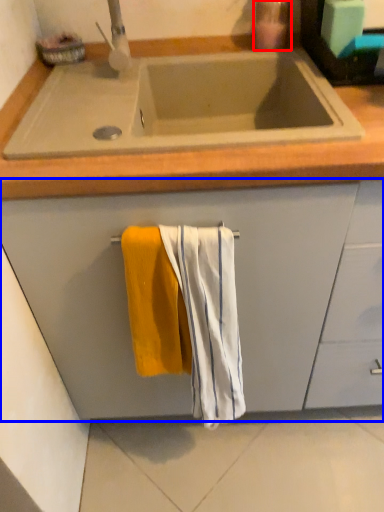
Question: Which of the following is the farthest to the observer, soap dispenser (highlighted by a red box) or cabinetry (highlighted by a blue box)?

Choices:
 (A) soap dispenser
 (B) cabinetry

Answer: (A)